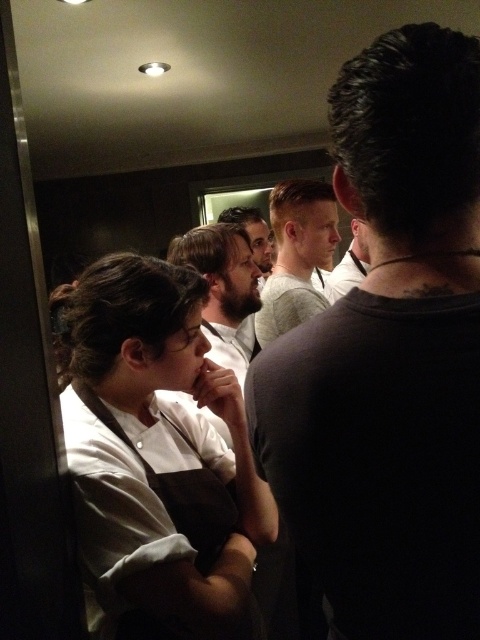
You are a new chef entering the kitchen and need to locate the white matte chef coat at left. Based on the scene description, where would you find it in relation to the other objects?

The white matte chef coat at left is located at point [158,452], which is on the left side of the scene.

You are a new chef in the kitchen and need to locate the dark gray shirt at right and the bearded man at center. From your perspective facing the group, which of the two is positioned more to the right?

The dark gray shirt at right is positioned on the right side of the bearded man at center, so it is more to the right.